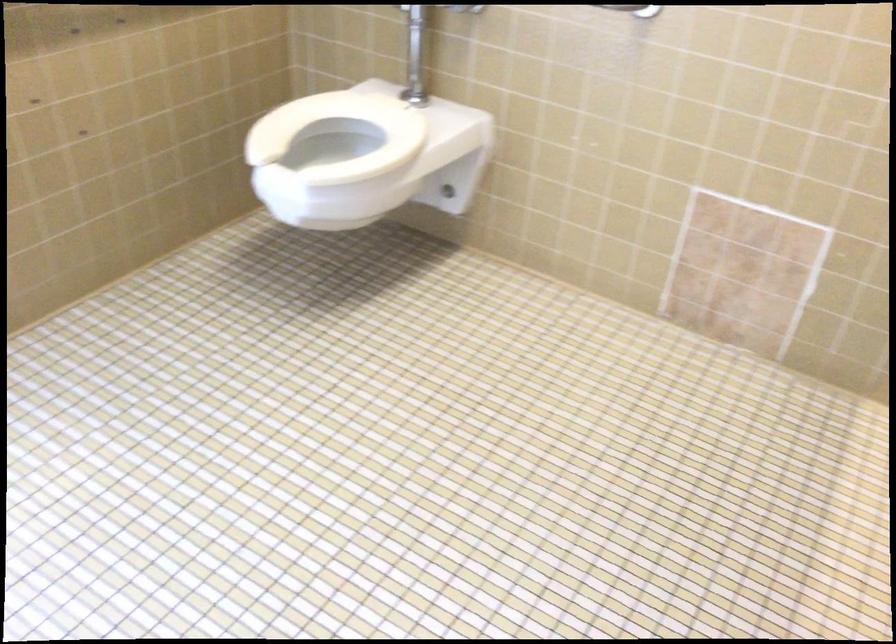
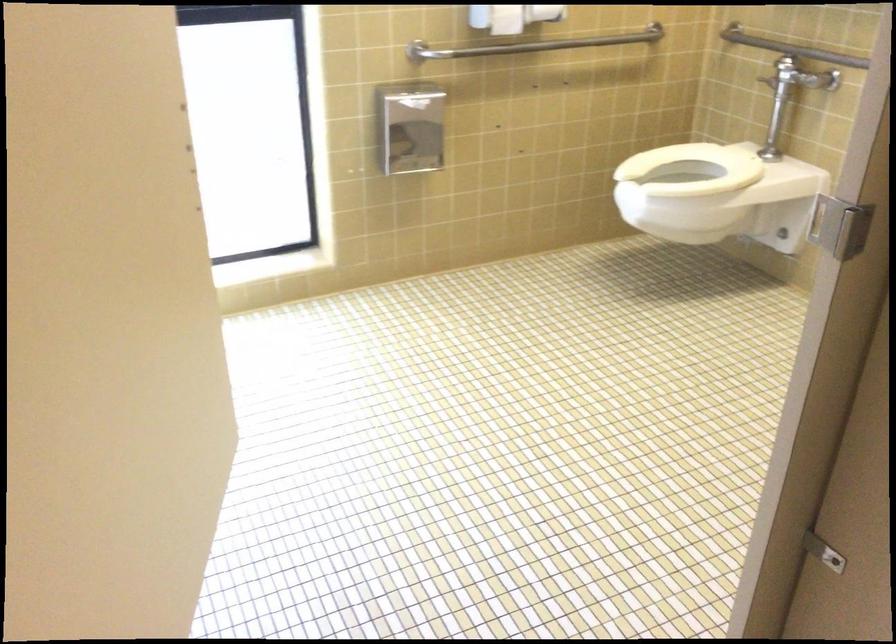
Find the pixel in the second image that matches [330,131] in the first image.

(692, 169)